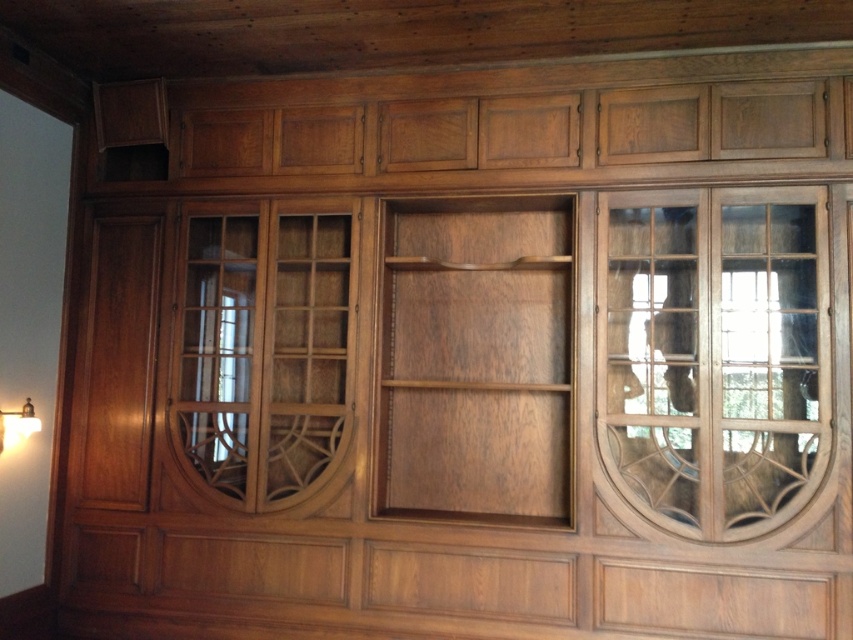
Between transparent wood glass door at center right and matte gold lampshade at lower left, which one appears on the left side from the viewer's perspective?

matte gold lampshade at lower left

Where is `transparent wood glass door at center right`? transparent wood glass door at center right is located at coordinates (714, 355).

Which is in front, point (799, 477) or point (19, 410)?

Point (799, 477)

Image resolution: width=853 pixels, height=640 pixels. Identify the location of transparent wood glass door at center right. (714, 355).

Which is above, transparent wood glass door at center right or clear glass door at center?

transparent wood glass door at center right

Is point (728, 212) farther from camera compared to point (339, 429)?

No, (728, 212) is in front of (339, 429).

Between point (636, 291) and point (254, 256), which one is positioned behind?

Point (254, 256)

Where is `transparent wood glass door at center right`? transparent wood glass door at center right is located at coordinates (714, 355).

Which is above, clear glass door at center or matte gold lampshade at lower left?

clear glass door at center is above.

Between point (213, 470) and point (16, 435), which one is positioned behind?

Point (213, 470)

Find the location of a particular element. This screenshot has height=640, width=853. clear glass door at center is located at coordinates (265, 348).